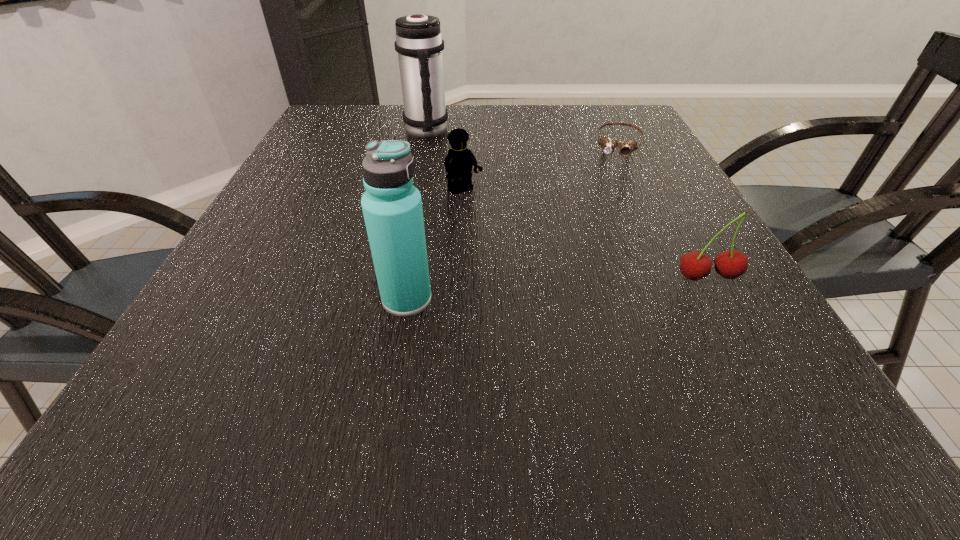
Find the location of `goggles that is at the right edge`. goggles that is at the right edge is located at coordinates (607, 144).

Where is `object situated at the far right corner`? The width and height of the screenshot is (960, 540). object situated at the far right corner is located at coordinates (607, 144).

The height and width of the screenshot is (540, 960). Find the location of `vacant space at the far edge of the desktop`. vacant space at the far edge of the desktop is located at coordinates (x=546, y=108).

At what (x,y) coordinates should I click in order to perform the action: click on free region at the near edge. Please return your answer as a coordinate pair (x, y). The image size is (960, 540). Looking at the image, I should click on (322, 376).

The height and width of the screenshot is (540, 960). Find the location of `blank space at the left edge of the desktop`. blank space at the left edge of the desktop is located at coordinates (361, 150).

Where is `vacant space at the right edge of the desktop`? Image resolution: width=960 pixels, height=540 pixels. vacant space at the right edge of the desktop is located at coordinates (688, 214).

The image size is (960, 540). Find the location of `vacant region at the far left corner of the desktop`. vacant region at the far left corner of the desktop is located at coordinates (370, 111).

This screenshot has height=540, width=960. In order to click on vacant space at the far right corner in this screenshot , I will do `click(585, 106)`.

Locate an element on the screen. vacant space at the near right corner of the desktop is located at coordinates (773, 343).

Where is `empty location between the nearer thermos bottle and the third farthest object`? The image size is (960, 540). empty location between the nearer thermos bottle and the third farthest object is located at coordinates (436, 245).